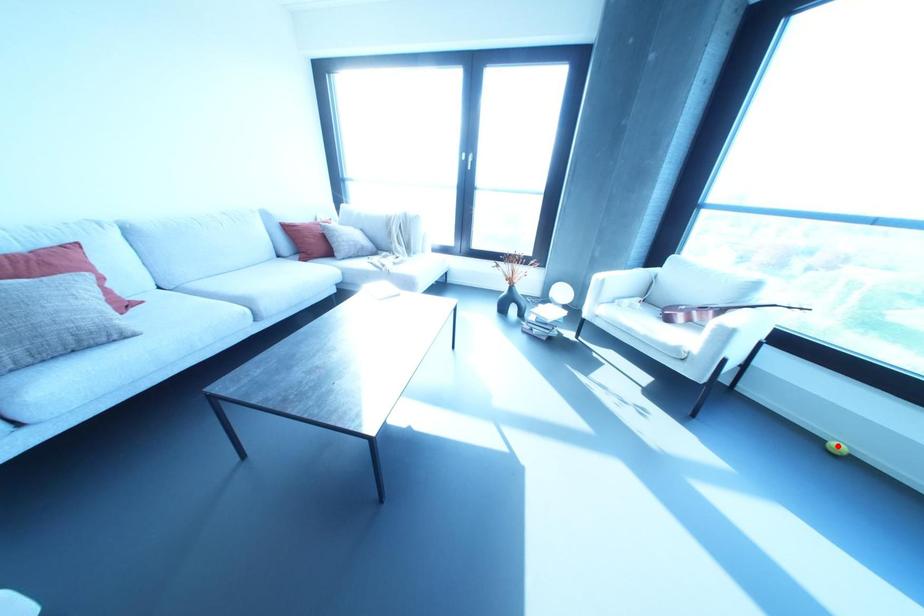
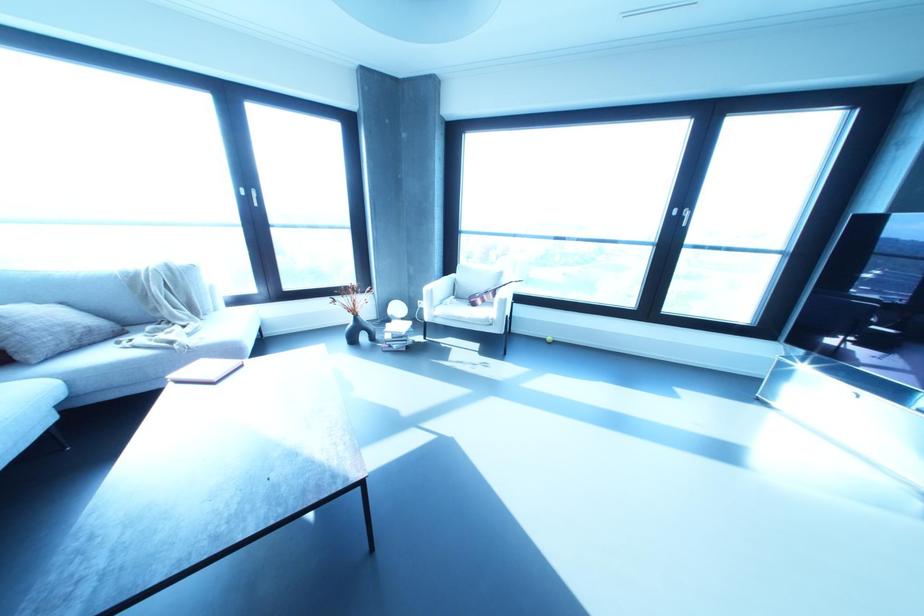
Question: I am providing you with two images of the same scene from different viewpoints. A red point is marked on the first image. Can you still see the location of the red point in image 2?

Choices:
 (A) Yes
 (B) No

Answer: (A)